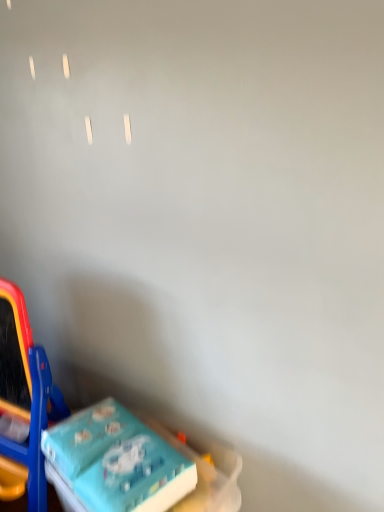
Question: Is blue plastic easel at lower left, arranged as the first toy when viewed from the left, thinner than blue cardboard box at lower left, the 1th toy viewed from the right?

Choices:
 (A) no
 (B) yes

Answer: (A)

Question: Does blue plastic easel at lower left, arranged as the first toy when viewed from the left, have a larger size compared to blue cardboard box at lower left, which appears as the second toy when viewed from the left?

Choices:
 (A) yes
 (B) no

Answer: (A)

Question: Could you tell me if blue plastic easel at lower left, which is the 2th toy in right-to-left order, is facing blue cardboard box at lower left, which appears as the second toy when viewed from the left?

Choices:
 (A) no
 (B) yes

Answer: (A)

Question: Considering the relative sizes of blue plastic easel at lower left, which is the 2th toy in right-to-left order, and blue cardboard box at lower left, which appears as the second toy when viewed from the left, in the image provided, is blue plastic easel at lower left, which is the 2th toy in right-to-left order, wider than blue cardboard box at lower left, which appears as the second toy when viewed from the left,?

Choices:
 (A) no
 (B) yes

Answer: (B)

Question: Does blue plastic easel at lower left, arranged as the first toy when viewed from the left, appear on the left side of blue cardboard box at lower left, the 1th toy viewed from the right?

Choices:
 (A) yes
 (B) no

Answer: (A)

Question: From the image's perspective, is blue plastic easel at lower left, arranged as the first toy when viewed from the left, on top of blue cardboard box at lower left, which appears as the second toy when viewed from the left?

Choices:
 (A) yes
 (B) no

Answer: (A)

Question: Can you confirm if blue cardboard box at lower left, which appears as the second toy when viewed from the left, is shorter than blue plastic easel at lower left, which is the 2th toy in right-to-left order?

Choices:
 (A) yes
 (B) no

Answer: (A)

Question: Is blue cardboard box at lower left, the 1th toy viewed from the right, wider than blue plastic easel at lower left, which is the 2th toy in right-to-left order?

Choices:
 (A) no
 (B) yes

Answer: (A)

Question: Does blue cardboard box at lower left, which appears as the second toy when viewed from the left, have a greater height compared to blue plastic easel at lower left, arranged as the first toy when viewed from the left?

Choices:
 (A) yes
 (B) no

Answer: (B)

Question: Is blue cardboard box at lower left, the 1th toy viewed from the right, far from blue plastic easel at lower left, arranged as the first toy when viewed from the left?

Choices:
 (A) yes
 (B) no

Answer: (B)

Question: From a real-world perspective, is blue cardboard box at lower left, the 1th toy viewed from the right, positioned under blue plastic easel at lower left, which is the 2th toy in right-to-left order, based on gravity?

Choices:
 (A) no
 (B) yes

Answer: (B)

Question: Is blue cardboard box at lower left, which appears as the second toy when viewed from the left, surrounding blue plastic easel at lower left, arranged as the first toy when viewed from the left?

Choices:
 (A) no
 (B) yes

Answer: (A)

Question: Does point (29, 448) appear closer or farther from the camera than point (89, 410)?

Choices:
 (A) closer
 (B) farther

Answer: (A)